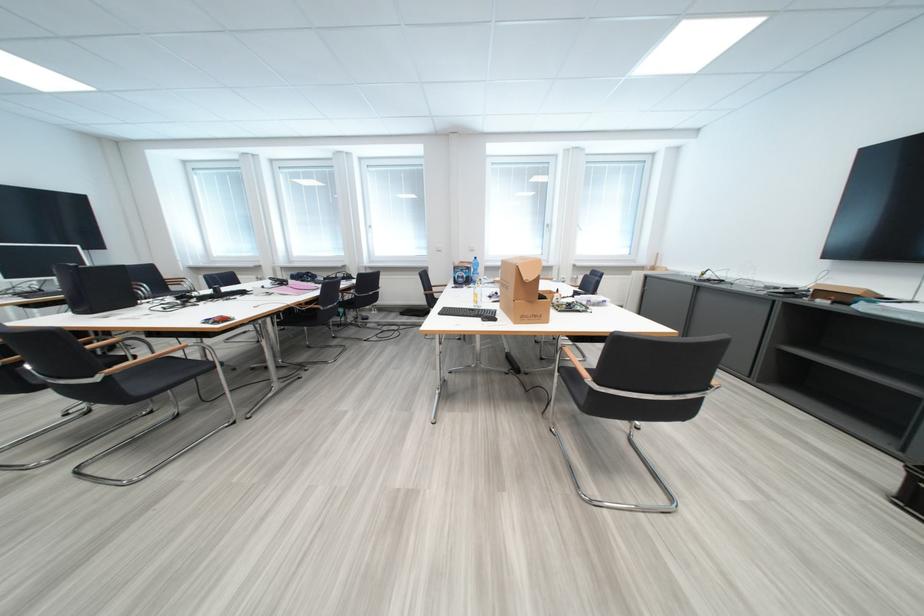
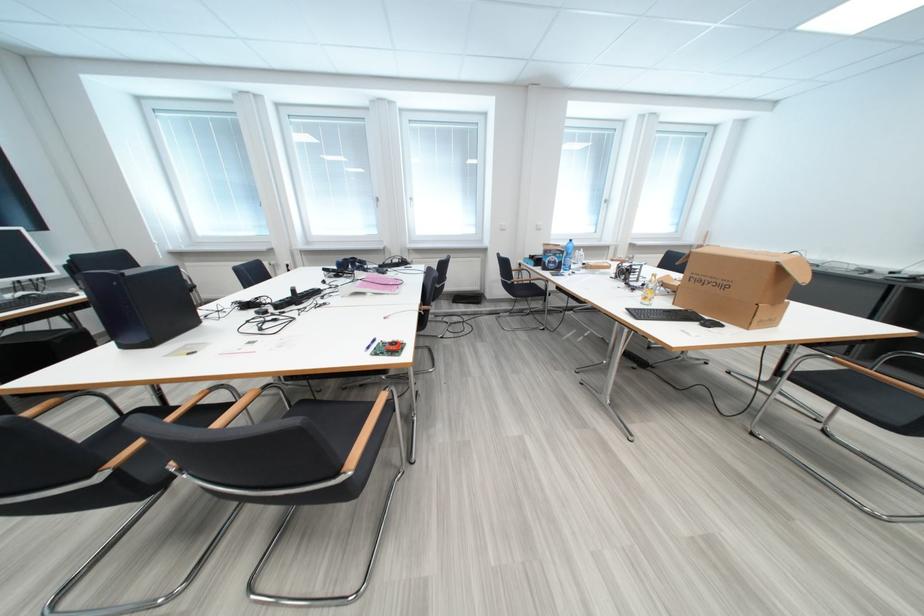
Find the pixel in the second image that matches pixel 472 273 in the first image.

(565, 257)